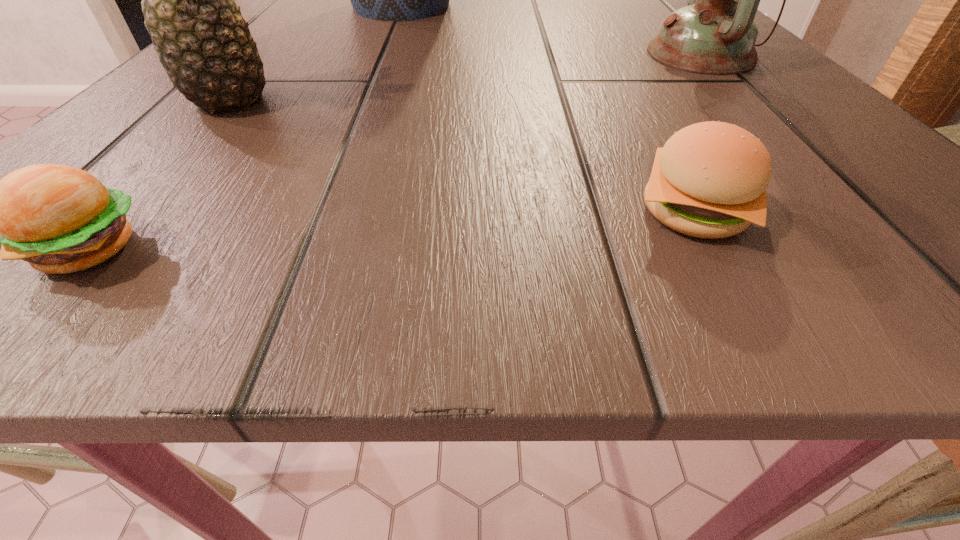
Locate an element on the screen. This screenshot has height=540, width=960. the second closest object to the right hamburger is located at coordinates (204, 44).

At what (x,y) coordinates should I click in order to perform the action: click on object that stands as the second closest to the oil lamp. Please return your answer as a coordinate pair (x, y). This screenshot has height=540, width=960. Looking at the image, I should click on (394, 0).